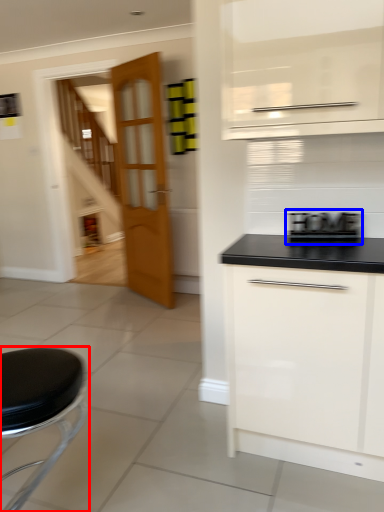
Question: Which object is further to the camera taking this photo, furniture (highlighted by a red box) or appliance (highlighted by a blue box)?

Choices:
 (A) furniture
 (B) appliance

Answer: (B)